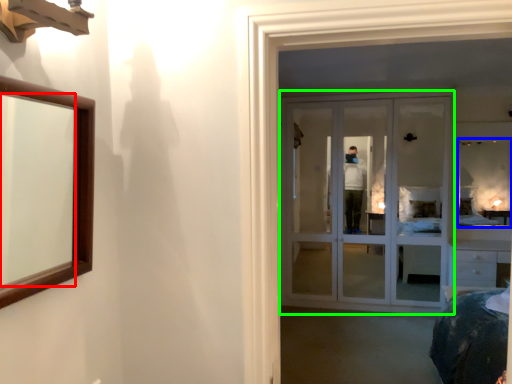
Question: Which object is positioned closest to mirror (highlighted by a red box)? Select from mirror (highlighted by a blue box) and door (highlighted by a green box).

Choices:
 (A) mirror
 (B) door

Answer: (B)